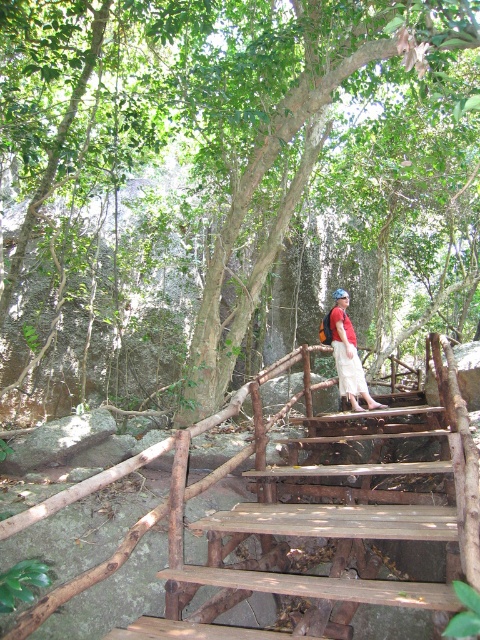
Question: Does green leafy tree at center appear on the left side of matte red shirt at center?

Choices:
 (A) yes
 (B) no

Answer: (A)

Question: Which of these objects is positioned farthest from the rusty wood stairs at center?

Choices:
 (A) matte red shirt at center
 (B) green leafy tree at center

Answer: (B)

Question: Which object is closer to the camera taking this photo?

Choices:
 (A) green leafy tree at center
 (B) rusty wood stairs at center

Answer: (B)

Question: Is rusty wood stairs at center smaller than matte red shirt at center?

Choices:
 (A) yes
 (B) no

Answer: (B)

Question: Is green leafy tree at center wider than matte red shirt at center?

Choices:
 (A) yes
 (B) no

Answer: (A)

Question: Which point is farther from the camera taking this photo?

Choices:
 (A) (252, 632)
 (B) (199, 268)
 (C) (344, 307)

Answer: (B)